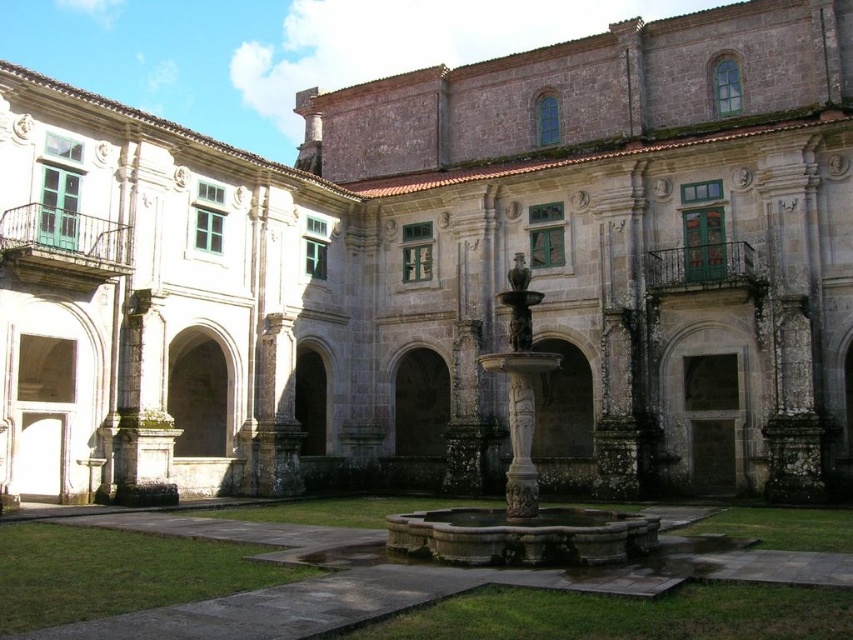
Which is below, stone fountain at center or carved stone fountain at center?

stone fountain at center is lower down.

Which is in front, point (817, 621) or point (529, 292)?

Positioned in front is point (817, 621).

Locate an element on the screen. stone fountain at center is located at coordinates (227, 580).